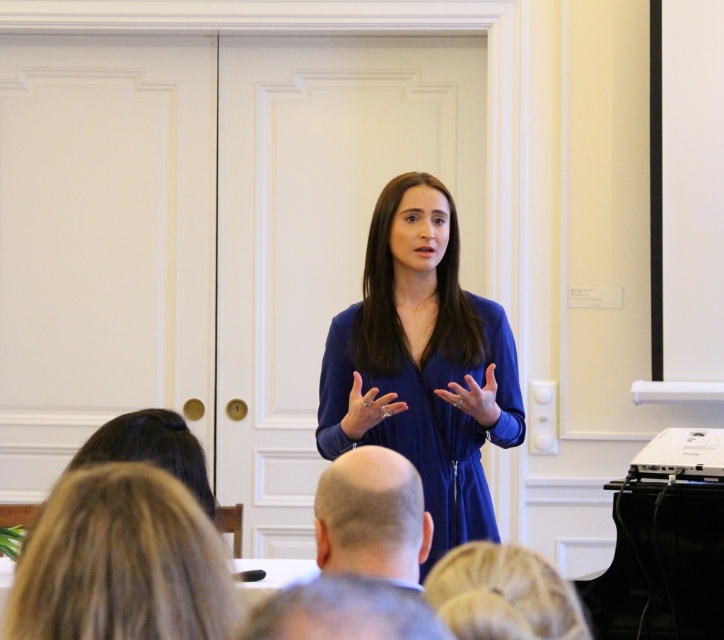
Is blue silk dress at center taller than matte blue dress at center?

Yes, blue silk dress at center is taller than matte blue dress at center.

Who is more distant from viewer, (345, 408) or (342, 419)?

Positioned behind is point (345, 408).

Is point (467, 307) positioned behind point (353, 428)?

That is True.

At what (x,y) coordinates should I click in order to perform the action: click on blue silk dress at center. Please return your answer as a coordinate pair (x, y). This screenshot has width=724, height=640. Looking at the image, I should click on (420, 362).

Can you confirm if blue silk dress at lower center is thinner than gray hair at lower center?

Incorrect, blue silk dress at lower center's width is not less than gray hair at lower center's.

Is blue silk dress at lower center further to the viewer compared to gray hair at lower center?

Yes, blue silk dress at lower center is further from the viewer.

Consider the image. Who is more distant from viewer, (182,552) or (298,618)?

Positioned behind is point (182,552).

The image size is (724, 640). I want to click on blue silk dress at lower center, so click(122, 563).

Who is positioned more to the right, gray hair at lower center or blue fabric hand at center?

blue fabric hand at center is more to the right.

Can you confirm if gray hair at lower center is thinner than blue fabric hand at center?

In fact, gray hair at lower center might be wider than blue fabric hand at center.

Find the location of a particular element. gray hair at lower center is located at coordinates (342, 612).